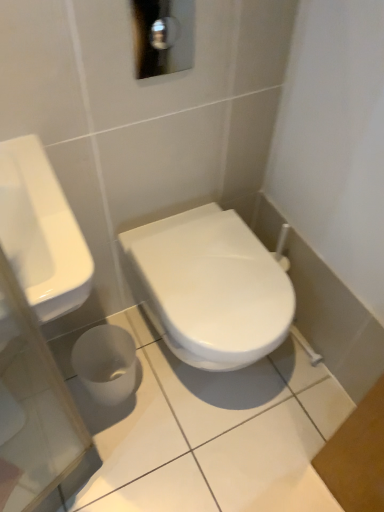
This screenshot has height=512, width=384. Find the location of `vacant area that is in front of white glossy toilet at center`. vacant area that is in front of white glossy toilet at center is located at coordinates (194, 456).